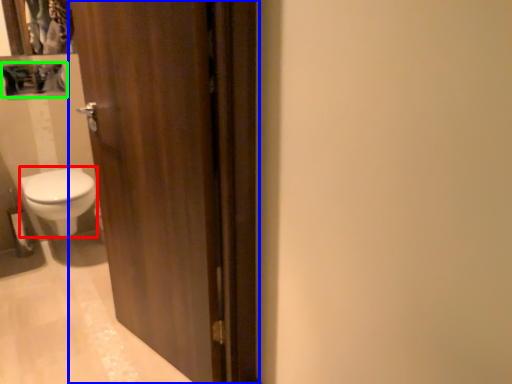
Question: Considering the real-world distances, which object is closest to bidet (highlighted by a red box)? door (highlighted by a blue box) or medicine cabinet (highlighted by a green box).

Choices:
 (A) door
 (B) medicine cabinet

Answer: (B)